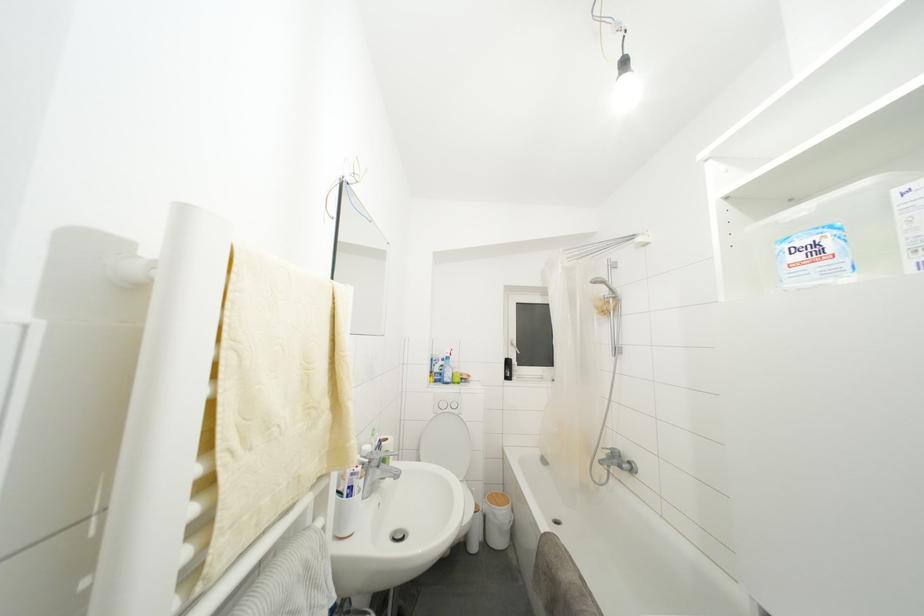
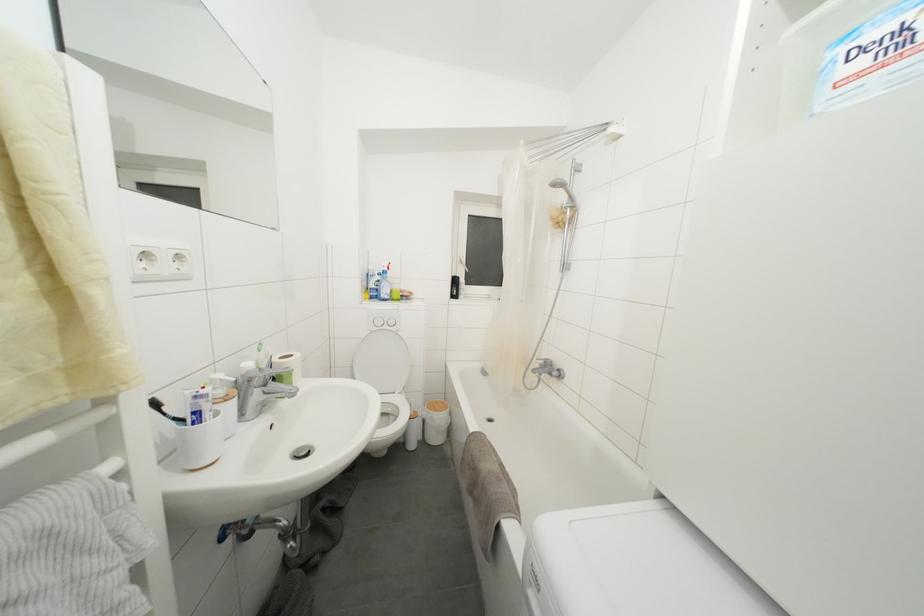
Question: The images are taken continuously from a first-person perspective. In which direction is your viewpoint rotating?

Choices:
 (A) Left
 (B) Right
 (C) Up
 (D) Down

Answer: (D)